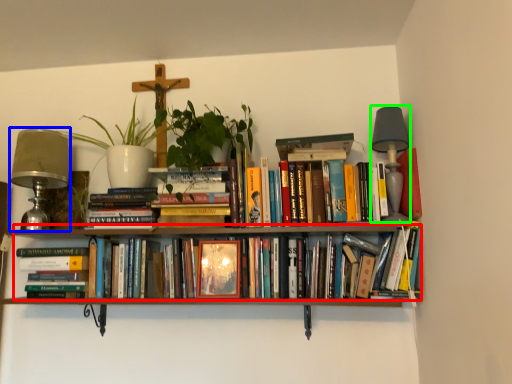
Question: Which object is positioned farthest from book (highlighted by a red box)? Select from table lamp (highlighted by a blue box) and table lamp (highlighted by a green box).

Choices:
 (A) table lamp
 (B) table lamp

Answer: (A)